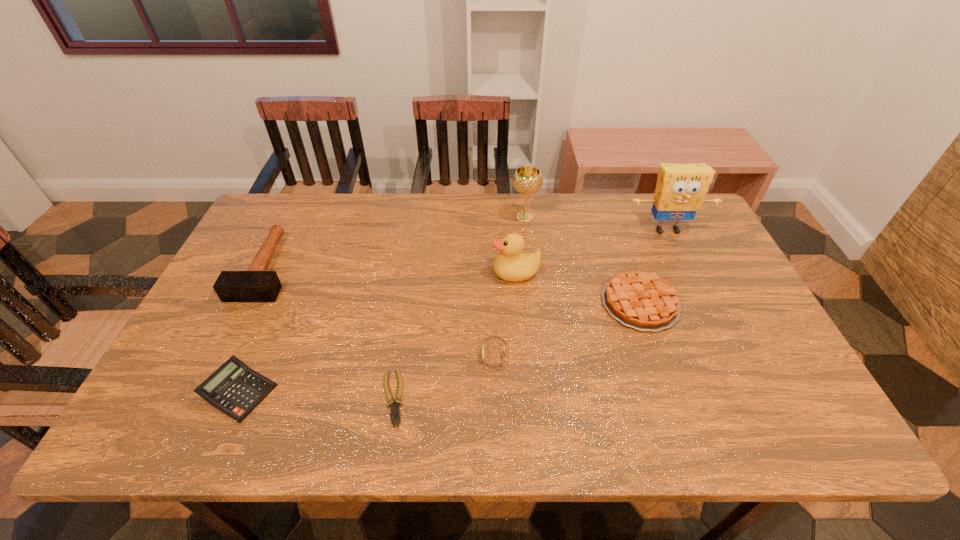
Image resolution: width=960 pixels, height=540 pixels. In order to click on empty space that is in between the watch and the sponge in this screenshot , I will do `click(581, 293)`.

I want to click on free space between the mallet and the calculator, so click(252, 329).

Where is `vacant area between the second tallest object and the pie`? This screenshot has height=540, width=960. vacant area between the second tallest object and the pie is located at coordinates (582, 260).

Where is `free space between the watch and the calculator`? The height and width of the screenshot is (540, 960). free space between the watch and the calculator is located at coordinates (367, 374).

Where is `vacant area that lies between the pliers and the calculator`? vacant area that lies between the pliers and the calculator is located at coordinates (316, 395).

Locate which object ranks second in proximity to the tallest object. Please provide its 2D coordinates. Your answer should be formatted as a tuple, i.e. [(x, y)], where the tuple contains the x and y coordinates of a point satisfying the conditions above.

[(527, 180)]

Identify which object is the fourth closest to the calculator. Please provide its 2D coordinates. Your answer should be formatted as a tuple, i.e. [(x, y)], where the tuple contains the x and y coordinates of a point satisfying the conditions above.

[(511, 265)]

At what (x,y) coordinates should I click in order to perform the action: click on free space in the image that satisfies the following two spatial constraints: 1. on the face of the watch; 2. on the front side of the calculator. Please return your answer as a coordinate pair (x, y). This screenshot has height=540, width=960. Looking at the image, I should click on (494, 392).